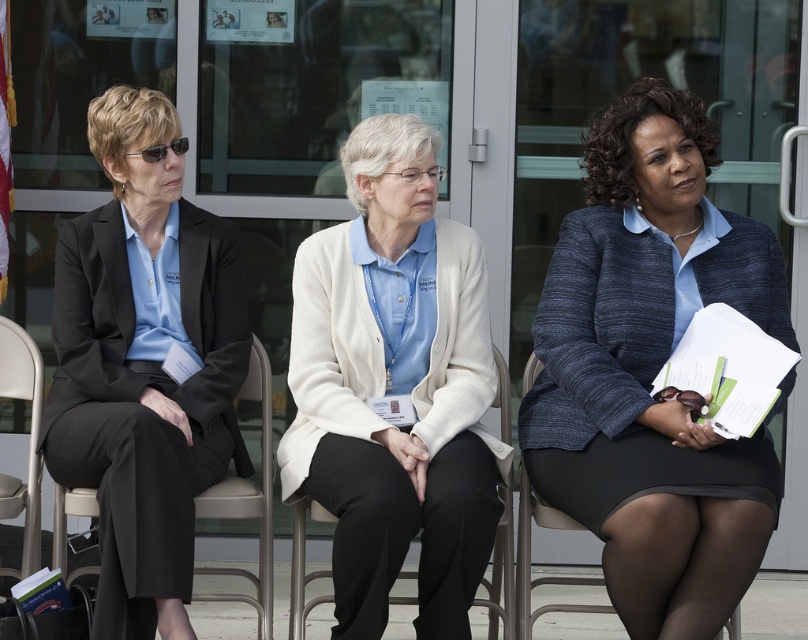
Question: Can you confirm if blue textured blazer at center is thinner than black matte suit at left?

Choices:
 (A) yes
 (B) no

Answer: (B)

Question: Is light beige cardigan at center in front of black fabric chair at center?

Choices:
 (A) no
 (B) yes

Answer: (B)

Question: Which point is farther to the camera?

Choices:
 (A) blue textured blazer at center
 (B) metallic silver chair at left
 (C) light beige cardigan at center
 (D) black matte suit at left

Answer: (B)

Question: Which is farther from the black matte suit at left?

Choices:
 (A) metallic silver chair at left
 (B) light beige cardigan at center

Answer: (B)

Question: Is black matte suit at left thinner than metallic silver chair at left?

Choices:
 (A) yes
 (B) no

Answer: (B)

Question: Which of these objects is positioned closest to the blue textured blazer at center?

Choices:
 (A) black matte suit at left
 (B) light beige cardigan at center
 (C) black fabric chair at center

Answer: (B)